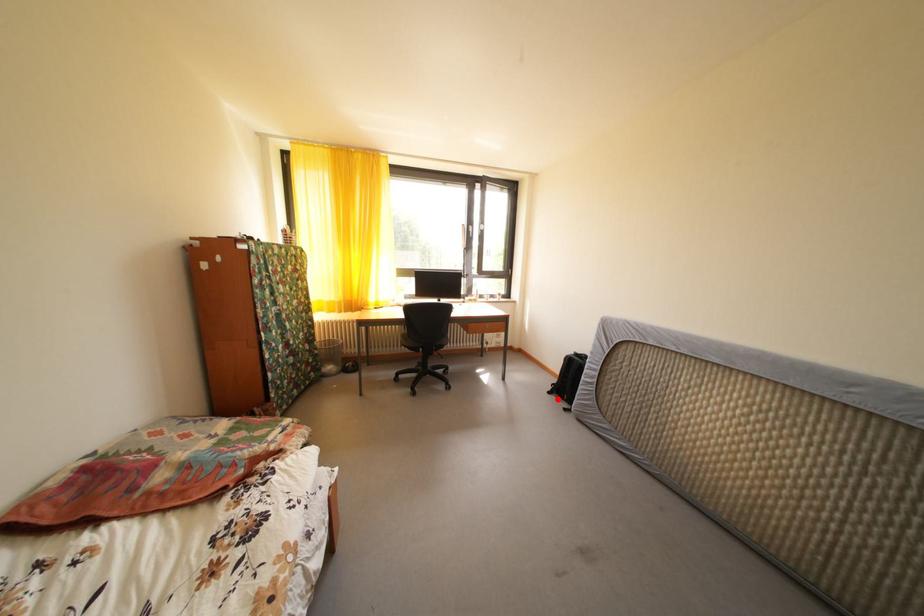
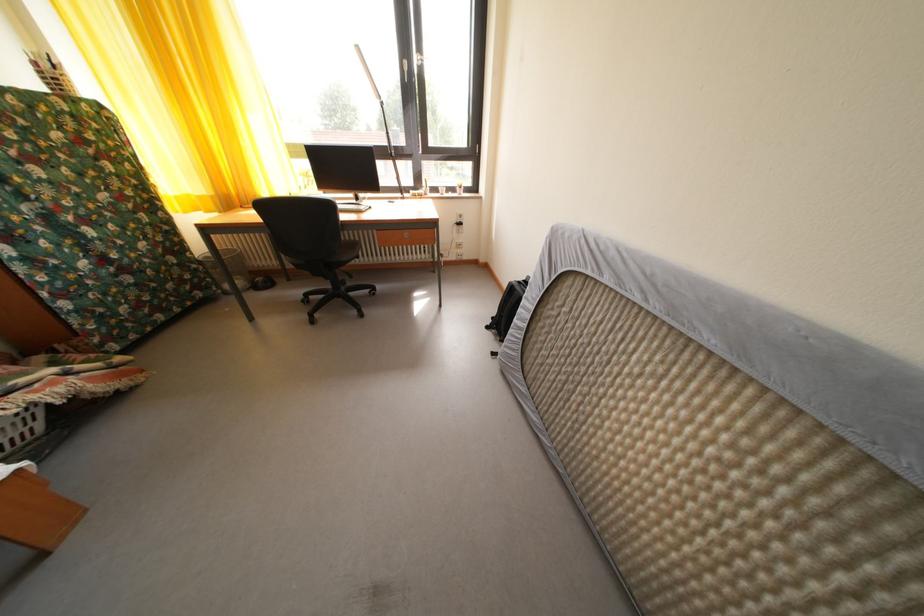
Where in the second image is the point corresponding to the highlighted location from the first image?

(496, 334)